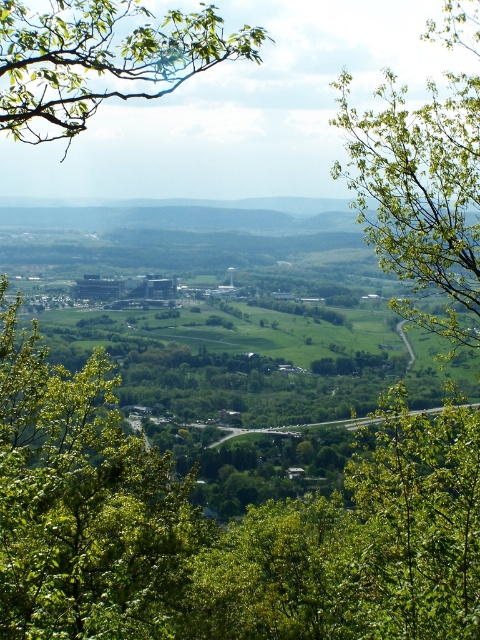
Does point (337, 624) come behind point (84, 81)?

No, it is not.

Measure the distance from green leafy tree at center to green leafy branch at upper left.

green leafy tree at center is 30.74 meters away from green leafy branch at upper left.

Which is in front, point (12, 339) or point (119, 77)?

Positioned in front is point (12, 339).

This screenshot has width=480, height=640. Find the location of `green leafy tree at center`. green leafy tree at center is located at coordinates (223, 529).

At what (x,y) coordinates should I click in order to perform the action: click on green leafy tree at upper right. Please return your answer as a coordinate pair (x, y). The width and height of the screenshot is (480, 640). Looking at the image, I should click on (420, 195).

Can you confirm if green leafy tree at upper right is taller than green leafy branch at upper left?

In fact, green leafy tree at upper right may be shorter than green leafy branch at upper left.

Where is `green leafy tree at upper right`? The width and height of the screenshot is (480, 640). green leafy tree at upper right is located at coordinates (420, 195).

Is green leafy tree at center to the right of green leafy tree at upper right from the viewer's perspective?

In fact, green leafy tree at center is to the left of green leafy tree at upper right.

Does green leafy tree at center appear under green leafy tree at upper right?

Yes.

Identify the location of green leafy tree at center. This screenshot has height=640, width=480. [223, 529].